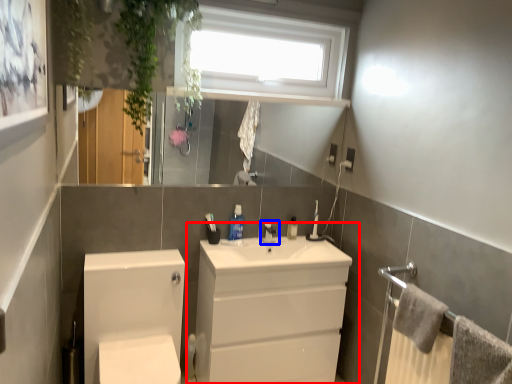
Question: Among these objects, which one is nearest to the camera, bathroom cabinet (highlighted by a red box) or tap (highlighted by a blue box)?

Choices:
 (A) bathroom cabinet
 (B) tap

Answer: (A)